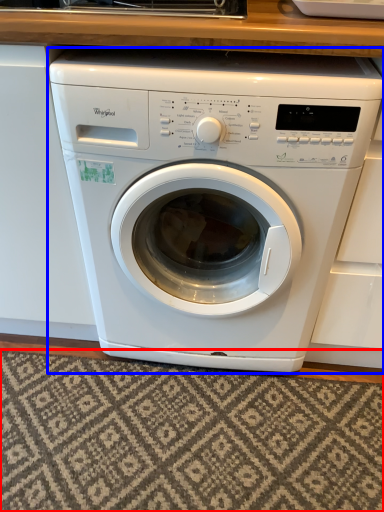
Question: Among these objects, which one is nearest to the camera, mat (highlighted by a red box) or washing machine (highlighted by a blue box)?

Choices:
 (A) mat
 (B) washing machine

Answer: (B)